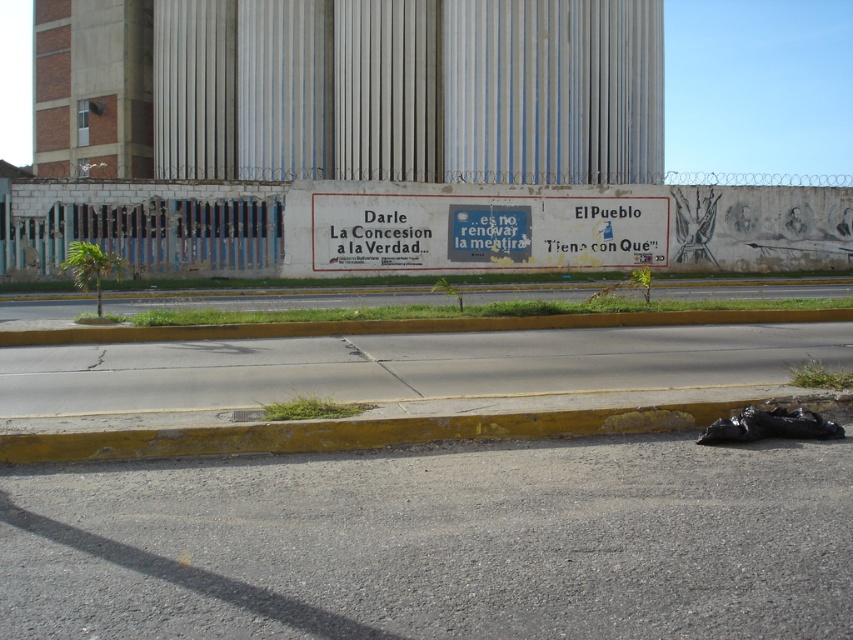
Consider the image. Is yellow painted curb at lower center in front of yellow concrete curb at lower center?

Yes, it is.

Does yellow painted curb at lower center appear over yellow concrete curb at lower center?

No, yellow painted curb at lower center is not above yellow concrete curb at lower center.

Is point (56, 435) farther from camera compared to point (618, 324)?

No, (56, 435) is closer to viewer.

The height and width of the screenshot is (640, 853). I want to click on yellow painted curb at lower center, so click(x=381, y=429).

Does gray asphalt at lower center come behind yellow concrete curb at lower center?

No, gray asphalt at lower center is closer to the viewer.

Can you confirm if gray asphalt at lower center is bigger than yellow concrete curb at lower center?

No.

Is point (323, 496) positioned in front of point (671, 324)?

Yes, point (323, 496) is closer to viewer.

At what (x,y) coordinates should I click in order to perform the action: click on gray asphalt at lower center. Please return your answer as a coordinate pair (x, y). Image resolution: width=853 pixels, height=640 pixels. Looking at the image, I should click on (437, 541).

Between point (804, 476) and point (315, 428), which one is positioned behind?

Point (315, 428)

Between gray asphalt at lower center and yellow painted curb at lower center, which one has more height?

yellow painted curb at lower center is taller.

Between point (549, 484) and point (430, 440), which one is positioned behind?

Point (430, 440)

Where is `gray asphalt at lower center`? gray asphalt at lower center is located at coordinates (437, 541).